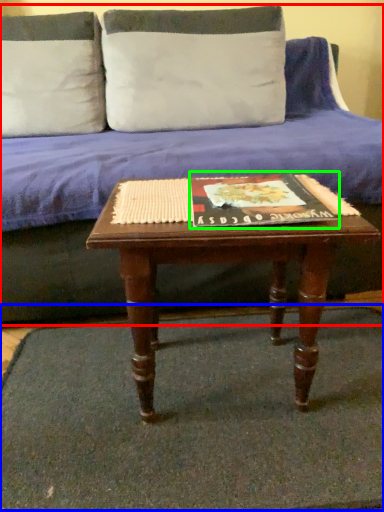
Question: Which is farther away from studio couch (highlighted by a red box)? doormat (highlighted by a blue box) or paperback book (highlighted by a green box)?

Choices:
 (A) doormat
 (B) paperback book

Answer: (B)